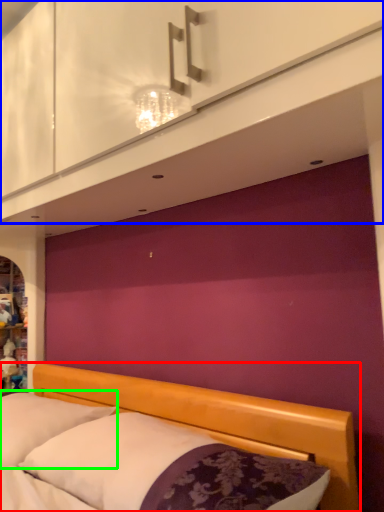
Question: Which is nearer to the bed (highlighted by a red box)? dresser (highlighted by a blue box) or pillow (highlighted by a green box).

Choices:
 (A) dresser
 (B) pillow

Answer: (B)